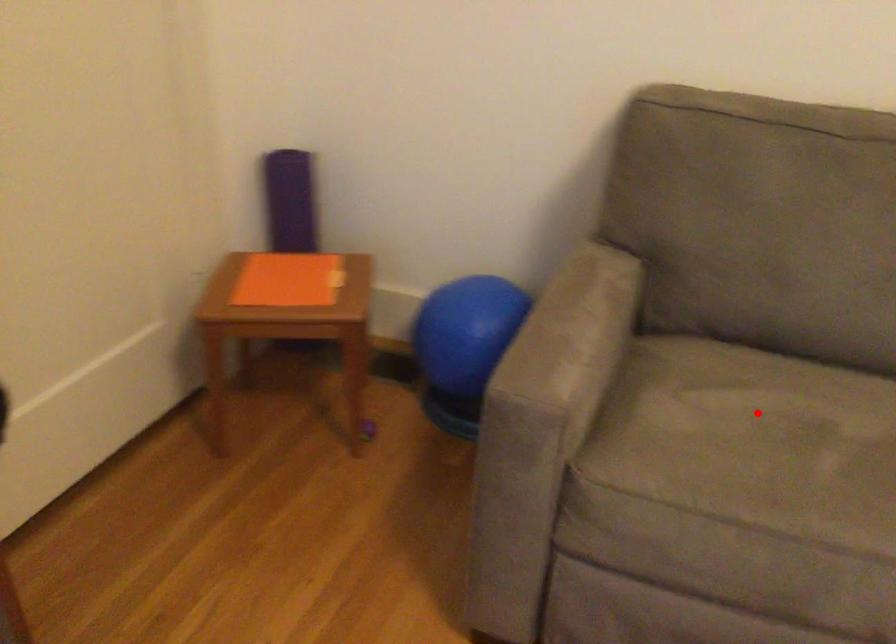
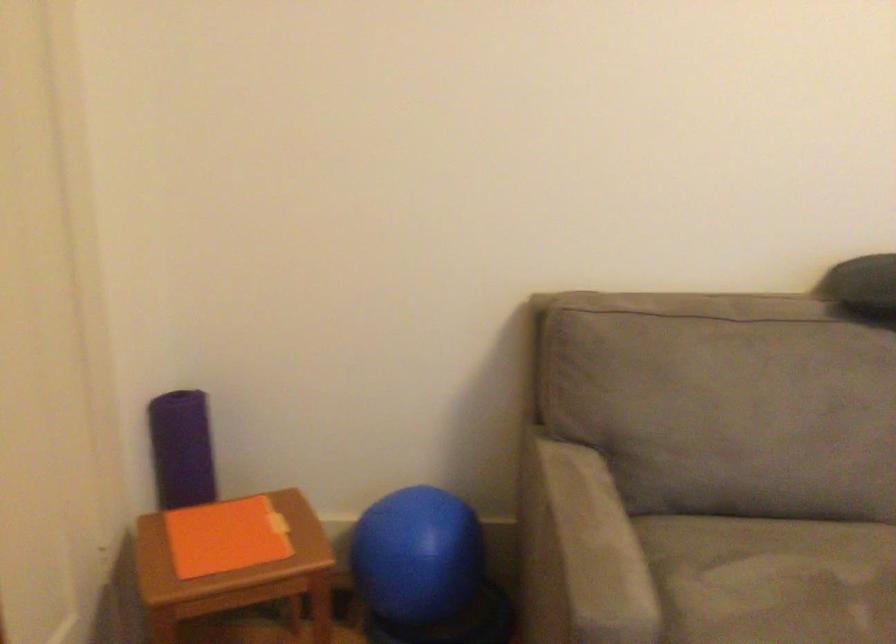
Where in the second image is the point corresponding to the highlighted location from the first image?

(771, 579)